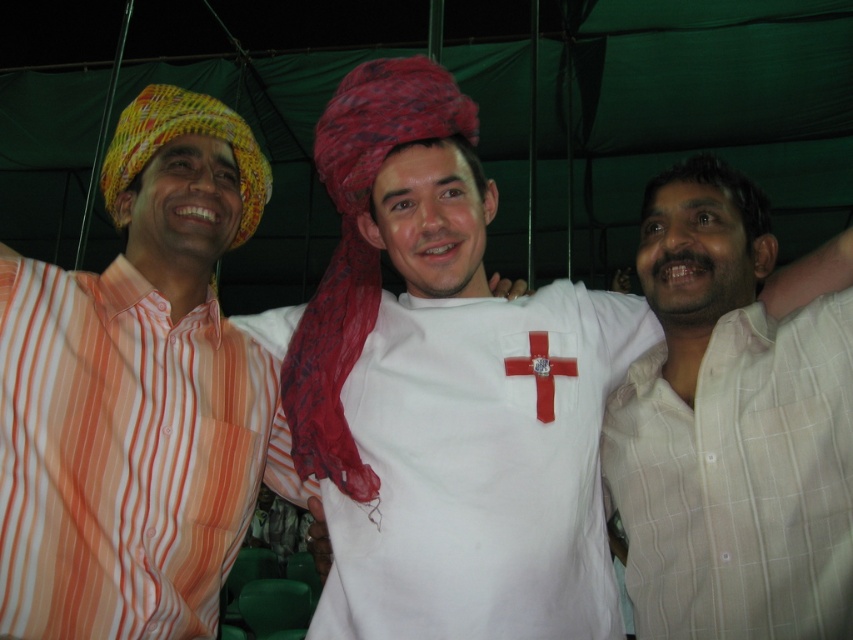
Consider the image. Is orange striped shirt at left below red matte cross at center?

Correct, orange striped shirt at left is located below red matte cross at center.

Between point (12, 321) and point (550, 401), which one is positioned behind?

The point (550, 401) is more distant.

The image size is (853, 640). Find the location of `orange striped shirt at left`. orange striped shirt at left is located at coordinates (125, 454).

Does yellow woven hat at left appear over red matte cross at center?

Correct, yellow woven hat at left is located above red matte cross at center.

Between point (223, 140) and point (527, 365), which one is positioned in front?

Point (527, 365) is more forward.

Which is behind, point (134, 138) or point (540, 387)?

The point (134, 138) is behind.

In order to click on yellow woven hat at left in this screenshot , I will do `click(180, 134)`.

Is point (315, 474) less distant than point (543, 404)?

No, it is behind (543, 404).

Is red fabric headscarf at center thinner than red matte cross at center?

Incorrect, red fabric headscarf at center's width is not less than red matte cross at center's.

Is point (358, 280) closer to viewer compared to point (573, 369)?

No, (358, 280) is behind (573, 369).

This screenshot has width=853, height=640. In order to click on red fabric headscarf at center in this screenshot , I will do `click(358, 248)`.